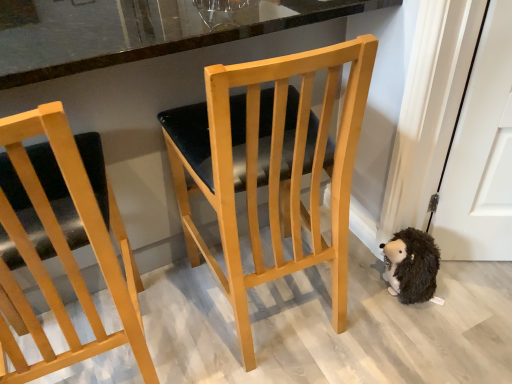
The image size is (512, 384). What do you see at coordinates (411, 265) in the screenshot? I see `black fuzzy stuffed animal at lower right` at bounding box center [411, 265].

Locate an element on the screen. The width and height of the screenshot is (512, 384). light wood chair at center, arranged as the 2th chair when viewed from the left is located at coordinates (271, 164).

Between black fuzzy stuffed animal at lower right and light wood chair at center, acting as the first chair starting from the right, which one has smaller width?

With smaller width is black fuzzy stuffed animal at lower right.

Is black fuzzy stuffed animal at lower right touching light wood chair at center, arranged as the 2th chair when viewed from the left?

They are not placed beside each other.

Image resolution: width=512 pixels, height=384 pixels. Identify the location of the 1st chair in front of the black fuzzy stuffed animal at lower right, starting your count from the anchor. (271, 164).

From the image's perspective, is black fuzzy stuffed animal at lower right over light wood chair at center, arranged as the 2th chair when viewed from the left?

No, from the image's perspective, black fuzzy stuffed animal at lower right is not over light wood chair at center, arranged as the 2th chair when viewed from the left.

From a real-world perspective, is light wood chair at left, placed as the second chair when sorted from right to left, physically located above or below black fuzzy stuffed animal at lower right?

In terms of real-world spatial position, light wood chair at left, placed as the second chair when sorted from right to left, is above black fuzzy stuffed animal at lower right.

Is black fuzzy stuffed animal at lower right inside light wood chair at left, placed as the second chair when sorted from right to left?

No, black fuzzy stuffed animal at lower right is not a part of light wood chair at left, placed as the second chair when sorted from right to left.

Which is in front, light wood chair at left, which appears as the first chair when viewed from the left, or black fuzzy stuffed animal at lower right?

light wood chair at left, which appears as the first chair when viewed from the left, is more forward.

Considering the relative positions of light wood chair at left, which appears as the first chair when viewed from the left, and black fuzzy stuffed animal at lower right in the image provided, is light wood chair at left, which appears as the first chair when viewed from the left, to the left of black fuzzy stuffed animal at lower right from the viewer's perspective?

Indeed, light wood chair at left, which appears as the first chair when viewed from the left, is positioned on the left side of black fuzzy stuffed animal at lower right.

Would you say light wood chair at center, arranged as the 2th chair when viewed from the left, is to the left or to the right of black fuzzy stuffed animal at lower right in the picture?

Clearly, light wood chair at center, arranged as the 2th chair when viewed from the left, is on the left of black fuzzy stuffed animal at lower right in the image.

Between light wood chair at center, acting as the first chair starting from the right, and black fuzzy stuffed animal at lower right, which one is positioned behind?

Positioned behind is black fuzzy stuffed animal at lower right.

Is black fuzzy stuffed animal at lower right at the back of light wood chair at center, arranged as the 2th chair when viewed from the left?

light wood chair at center, arranged as the 2th chair when viewed from the left, does not have its back to black fuzzy stuffed animal at lower right.

Is light wood chair at center, arranged as the 2th chair when viewed from the left, touching black fuzzy stuffed animal at lower right?

There is a gap between light wood chair at center, arranged as the 2th chair when viewed from the left, and black fuzzy stuffed animal at lower right.

Which object is further away from the camera, light wood chair at center, acting as the first chair starting from the right, or light wood chair at left, placed as the second chair when sorted from right to left?

light wood chair at center, acting as the first chair starting from the right.

Is light wood chair at center, arranged as the 2th chair when viewed from the left, smaller than light wood chair at left, which appears as the first chair when viewed from the left?

Incorrect, light wood chair at center, arranged as the 2th chair when viewed from the left, is not smaller in size than light wood chair at left, which appears as the first chair when viewed from the left.

Is light wood chair at center, acting as the first chair starting from the right, thinner than light wood chair at left, placed as the second chair when sorted from right to left?

Incorrect, the width of light wood chair at center, acting as the first chair starting from the right, is not less than that of light wood chair at left, placed as the second chair when sorted from right to left.

Are light wood chair at center, arranged as the 2th chair when viewed from the left, and light wood chair at left, placed as the second chair when sorted from right to left, far apart?

They are positioned close to each other.

Is point (95, 334) positioned behind point (318, 163)?

Yes, point (95, 334) is behind point (318, 163).

Which object is further away from the camera, light wood chair at left, placed as the second chair when sorted from right to left, or light wood chair at center, acting as the first chair starting from the right?

light wood chair at center, acting as the first chair starting from the right, is behind.

Considering the sizes of objects light wood chair at left, which appears as the first chair when viewed from the left, and light wood chair at center, acting as the first chair starting from the right, in the image provided, who is taller, light wood chair at left, which appears as the first chair when viewed from the left, or light wood chair at center, acting as the first chair starting from the right,?

Standing taller between the two is light wood chair at left, which appears as the first chair when viewed from the left.

Is the surface of light wood chair at left, placed as the second chair when sorted from right to left, in direct contact with light wood chair at center, acting as the first chair starting from the right?

light wood chair at left, placed as the second chair when sorted from right to left, is not next to light wood chair at center, acting as the first chair starting from the right, and they're not touching.

Can you tell me how much black fuzzy stuffed animal at lower right and light wood chair at left, placed as the second chair when sorted from right to left, differ in facing direction?

black fuzzy stuffed animal at lower right and light wood chair at left, placed as the second chair when sorted from right to left, are facing 41.1 degrees away from each other.

Is black fuzzy stuffed animal at lower right further to camera compared to light wood chair at left, which appears as the first chair when viewed from the left?

Yes, the depth of black fuzzy stuffed animal at lower right is greater than that of light wood chair at left, which appears as the first chair when viewed from the left.

From the picture: From the image's perspective, which one is positioned lower, black fuzzy stuffed animal at lower right or light wood chair at left, which appears as the first chair when viewed from the left?

black fuzzy stuffed animal at lower right.

Is black fuzzy stuffed animal at lower right taller or shorter than light wood chair at left, which appears as the first chair when viewed from the left?

Clearly, black fuzzy stuffed animal at lower right is shorter compared to light wood chair at left, which appears as the first chair when viewed from the left.

Where is `animal on the right side of light wood chair at center, acting as the first chair starting from the right`? The image size is (512, 384). animal on the right side of light wood chair at center, acting as the first chair starting from the right is located at coordinates (411, 265).

The height and width of the screenshot is (384, 512). What are the coordinates of `animal behind the light wood chair at left, placed as the second chair when sorted from right to left` in the screenshot? It's located at click(411, 265).

In the scene shown: When comparing their distances from light wood chair at left, placed as the second chair when sorted from right to left, does light wood chair at center, acting as the first chair starting from the right, or black fuzzy stuffed animal at lower right seem further?

Based on the image, black fuzzy stuffed animal at lower right appears to be further to light wood chair at left, placed as the second chair when sorted from right to left.

From the picture: When comparing their distances from light wood chair at left, which appears as the first chair when viewed from the left, does black fuzzy stuffed animal at lower right or light wood chair at center, arranged as the 2th chair when viewed from the left, seem further?

Among the two, black fuzzy stuffed animal at lower right is located further to light wood chair at left, which appears as the first chair when viewed from the left.

Considering their positions, is light wood chair at center, acting as the first chair starting from the right, positioned further to black fuzzy stuffed animal at lower right than light wood chair at left, which appears as the first chair when viewed from the left?

light wood chair at left, which appears as the first chair when viewed from the left, is further to black fuzzy stuffed animal at lower right.

Looking at the image, which one is located closer to black fuzzy stuffed animal at lower right, light wood chair at left, placed as the second chair when sorted from right to left, or light wood chair at center, acting as the first chair starting from the right?

light wood chair at center, acting as the first chair starting from the right, is positioned closer to the anchor black fuzzy stuffed animal at lower right.

Estimate the real-world distances between objects in this image. Which object is closer to light wood chair at center, arranged as the 2th chair when viewed from the left, black fuzzy stuffed animal at lower right or light wood chair at left, placed as the second chair when sorted from right to left?

light wood chair at left, placed as the second chair when sorted from right to left, lies closer to light wood chair at center, arranged as the 2th chair when viewed from the left, than the other object.

Estimate the real-world distances between objects in this image. Which object is further from light wood chair at center, arranged as the 2th chair when viewed from the left, light wood chair at left, placed as the second chair when sorted from right to left, or black fuzzy stuffed animal at lower right?

black fuzzy stuffed animal at lower right lies further to light wood chair at center, arranged as the 2th chair when viewed from the left, than the other object.

Where is `chair between light wood chair at left, placed as the second chair when sorted from right to left, and black fuzzy stuffed animal at lower right, in the horizontal direction`? Image resolution: width=512 pixels, height=384 pixels. chair between light wood chair at left, placed as the second chair when sorted from right to left, and black fuzzy stuffed animal at lower right, in the horizontal direction is located at coordinates (271, 164).